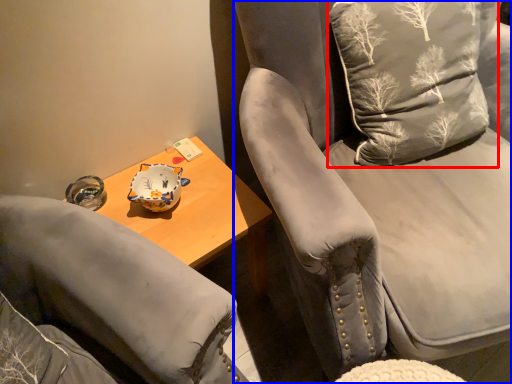
Question: Which object appears farthest to the camera in this image, throw pillow (highlighted by a red box) or chair (highlighted by a blue box)?

Choices:
 (A) throw pillow
 (B) chair

Answer: (A)